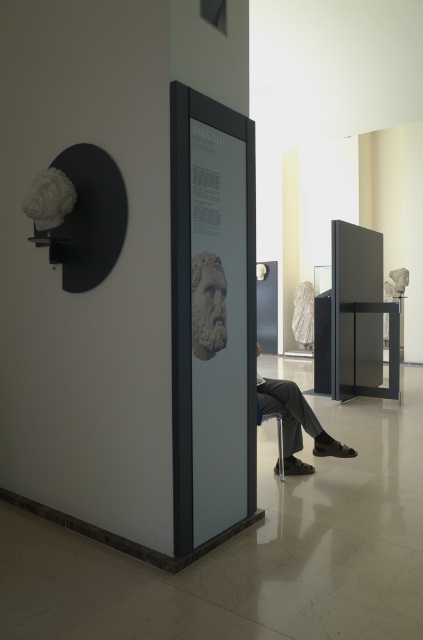
You are a visitor standing in the museum and see the dark gray fabric pants at lower center and the white marble bust at center. Which object is positioned more to the right side of the scene?

The dark gray fabric pants at lower center is positioned more to the right side of the scene compared to the white marble bust at center.

You are a visitor in the museum and want to touch the dark gray fabric pants at lower center located at point (296, 422). Can you reach it without moving your position?

The dark gray fabric pants at lower center at point (296, 422) is located at lower center, so it is within reach if you are standing at that position.

You are an art conservator standing in the museum and notice two items at the lower center of the room. You need to access the metallic silver chair at lower center to check its stability. Can you reach it without moving the dark gray fabric pants at lower center?

The dark gray fabric pants at lower center is above the metallic silver chair at lower center, so you can reach the metallic silver chair at lower center without moving the pants since it is positioned below.